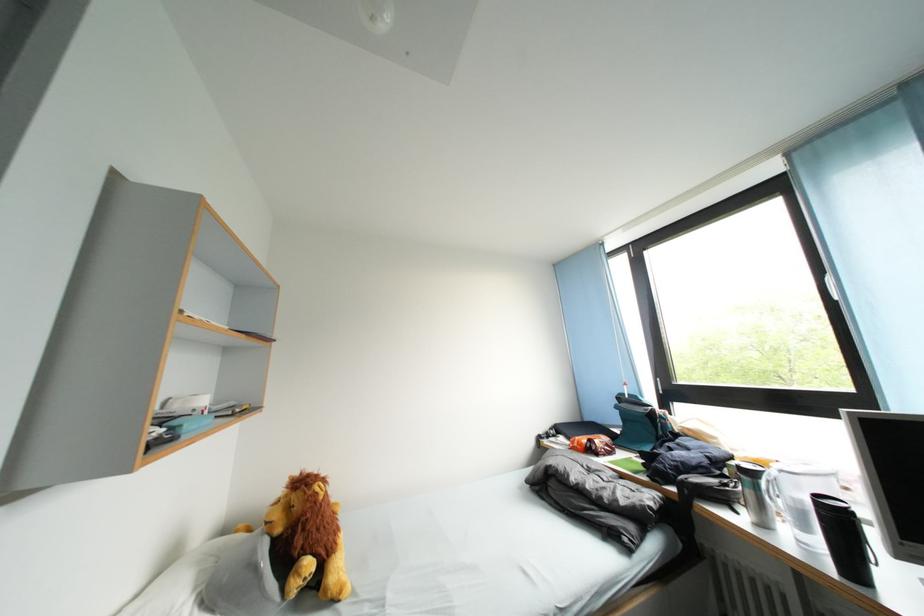
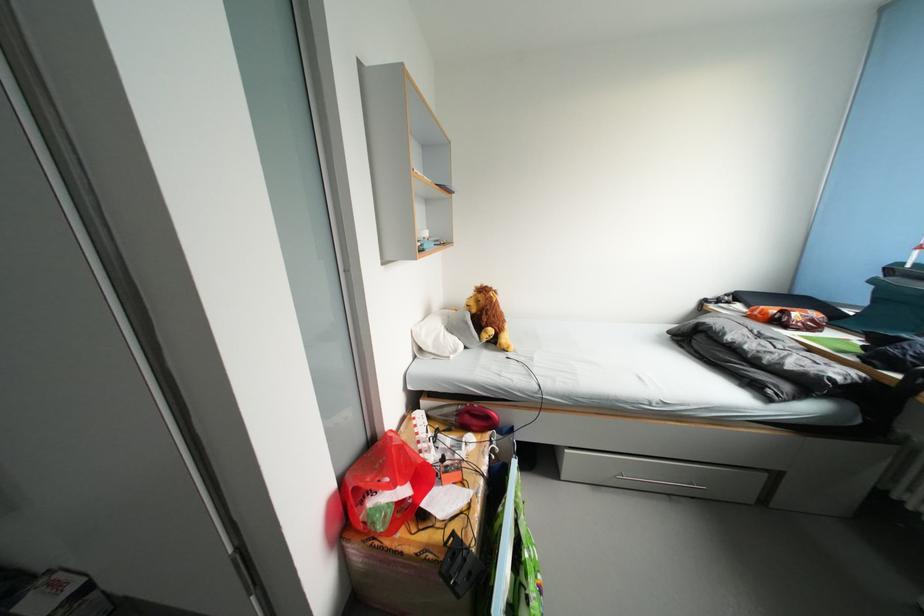
Locate, in the second image, the point that corresponds to [287,535] in the first image.

(482, 315)